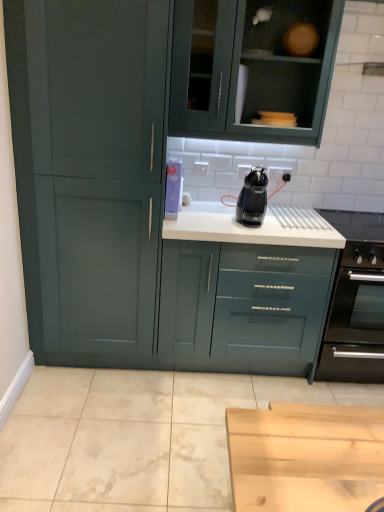
Question: Is black plastic coffee machine at center taller or shorter than matte green cupboard at left?

Choices:
 (A) tall
 (B) short

Answer: (B)

Question: Is point (244, 200) positioned closer to the camera than point (109, 119)?

Choices:
 (A) closer
 (B) farther

Answer: (B)

Question: Which of these objects is positioned closest to the matte green cupboard at left?

Choices:
 (A) matte green cabinet at upper center
 (B) black plastic coffee machine at center
 (C) black matte oven at right

Answer: (A)

Question: Which object is positioned farthest from the black matte oven at right?

Choices:
 (A) matte green cupboard at left
 (B) black plastic coffee machine at center
 (C) matte green cabinet at upper center

Answer: (A)